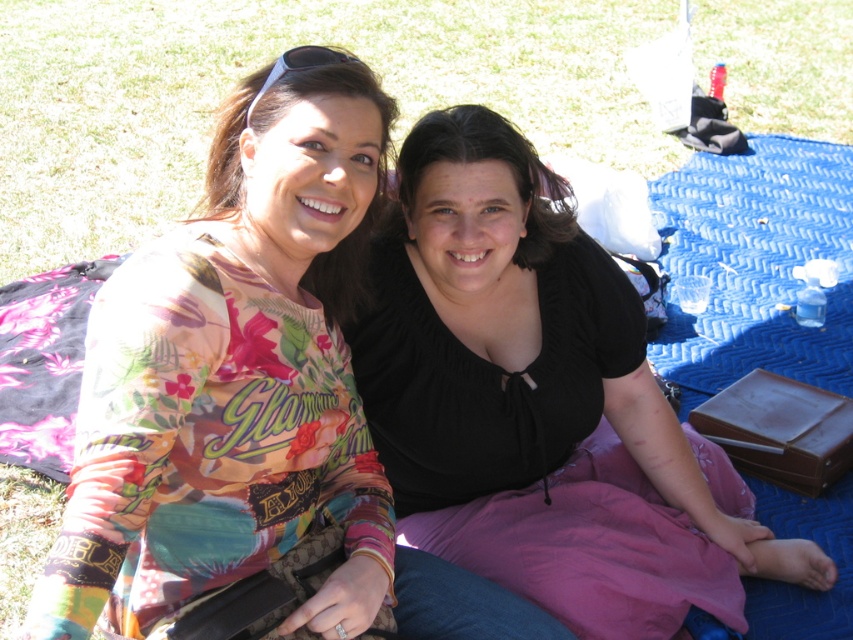
Question: Is floral printed shirt at center smaller than black satin blouse at center?

Choices:
 (A) yes
 (B) no

Answer: (A)

Question: In this image, where is floral printed shirt at center located relative to pink floral fabric at left?

Choices:
 (A) left
 (B) right

Answer: (B)

Question: Based on their relative distances, which object is nearer to the pink floral fabric at left?

Choices:
 (A) green grass at upper left
 (B) black satin blouse at center

Answer: (B)

Question: Where is green grass at upper left located in relation to pink floral fabric at left in the image?

Choices:
 (A) above
 (B) below

Answer: (A)

Question: Which of the following is the farthest from the observer?

Choices:
 (A) green grass at upper left
 (B) pink floral fabric at left
 (C) black satin blouse at center

Answer: (A)

Question: Which of these objects is positioned closest to the floral printed shirt at center?

Choices:
 (A) green grass at upper left
 (B) black satin blouse at center

Answer: (B)